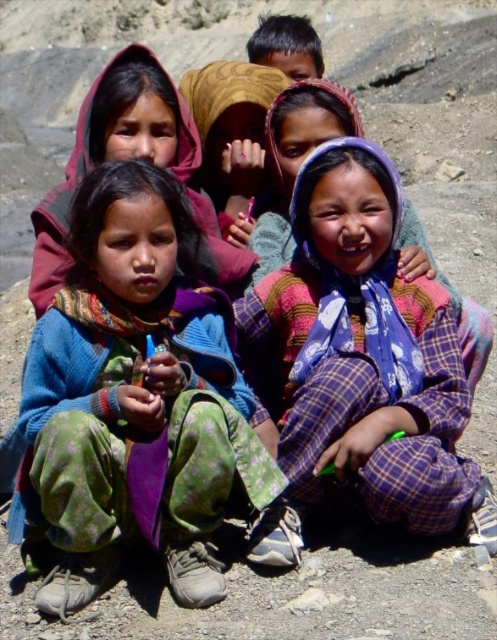
Question: Which of the following is the closest to the observer?

Choices:
 (A) plaid fabric child at center
 (B) dark brown hair at upper center
 (C) blue knitted sweater at center

Answer: (C)

Question: Is blue knitted sweater at center further to the viewer compared to dark brown hair at upper center?

Choices:
 (A) no
 (B) yes

Answer: (A)

Question: Can you confirm if plaid fabric child at center is thinner than dark brown hair at upper center?

Choices:
 (A) yes
 (B) no

Answer: (A)

Question: Can you confirm if blue knitted sweater at center is positioned to the right of plaid fabric child at center?

Choices:
 (A) no
 (B) yes

Answer: (A)

Question: Which point is farther to the camera?

Choices:
 (A) blue knitted sweater at center
 (B) plaid fabric child at center

Answer: (B)

Question: Which point is closer to the camera?

Choices:
 (A) (38, 544)
 (B) (293, 40)
 (C) (385, 467)

Answer: (C)